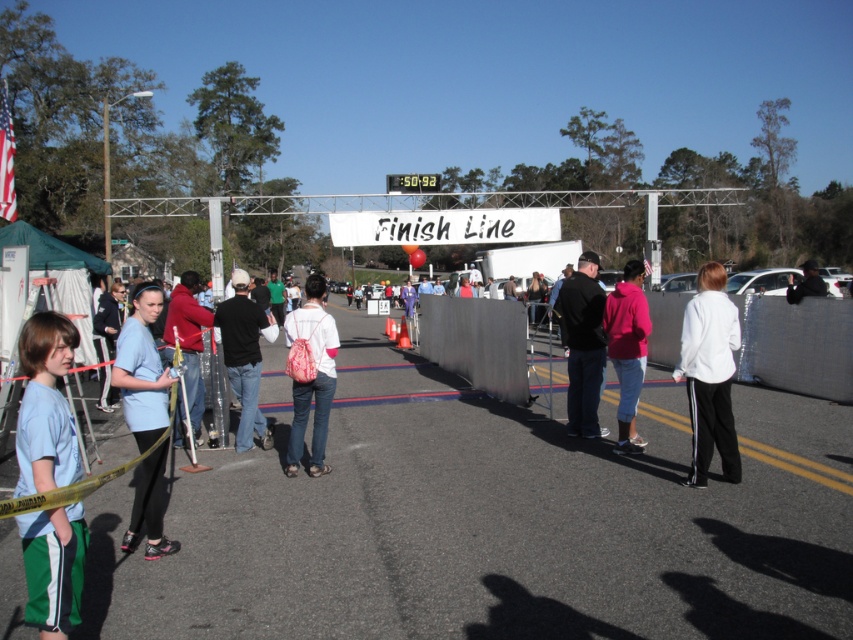
Question: Which point is farther from the camera taking this photo?

Choices:
 (A) click(x=141, y=385)
 (B) click(x=178, y=321)
 (C) click(x=595, y=380)

Answer: (C)

Question: Can you confirm if red fleece jacket at center is wider than dark blue shirt at center?

Choices:
 (A) no
 (B) yes

Answer: (A)

Question: Is pink fleece jacket at center in front of dark blue shirt at center?

Choices:
 (A) yes
 (B) no

Answer: (A)

Question: Which of the following is the closest to the observer?

Choices:
 (A) light blue t-shirt at left
 (B) dark blue jeans at center
 (C) pink fleece jacket at center

Answer: (A)

Question: Which of the following is the closest to the observer?

Choices:
 (A) metallic gray barrier at center
 (B) dark blue jeans at center
 (C) dark blue shirt at center
 (D) light blue fabric at center

Answer: (D)

Question: Is black matte jacket at center above red fleece jacket at center?

Choices:
 (A) yes
 (B) no

Answer: (A)